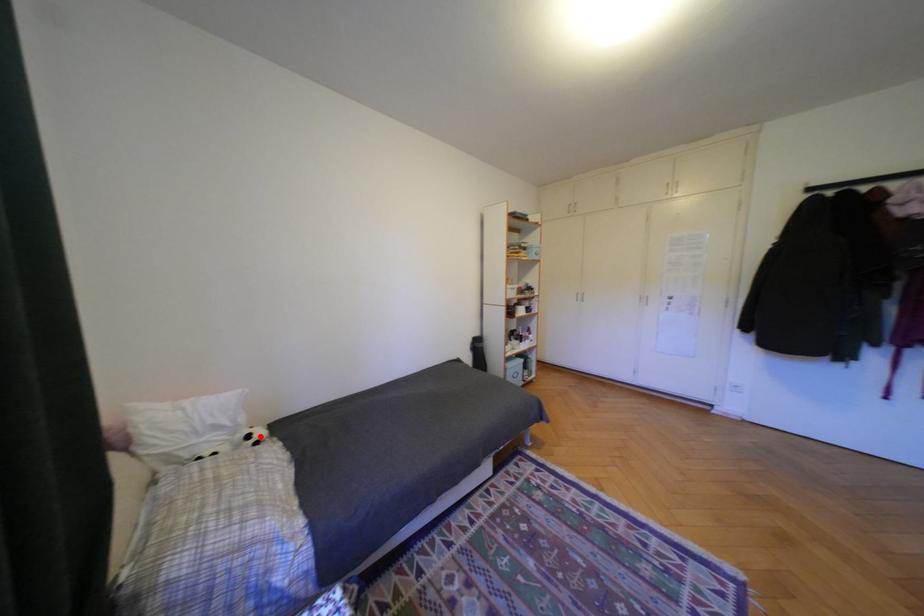
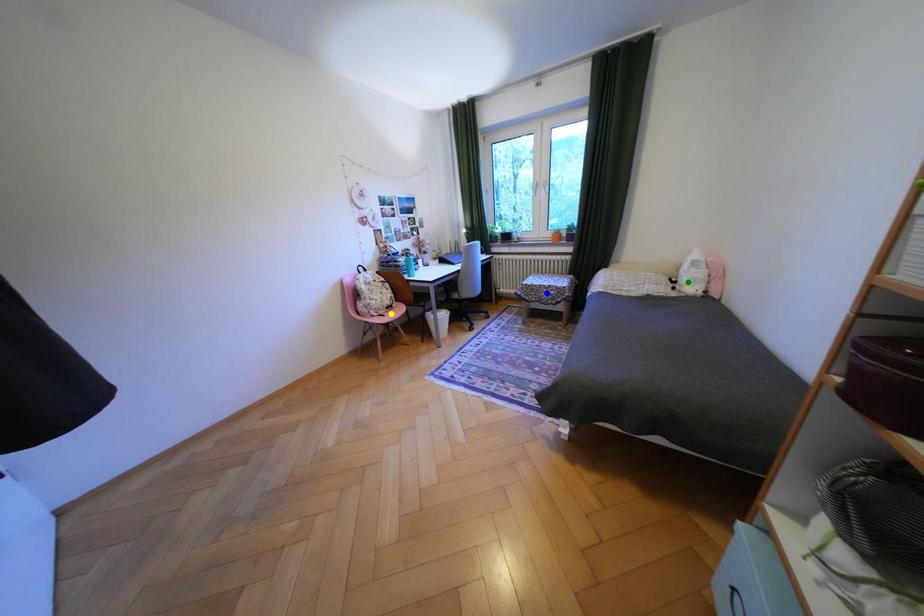
Question: I am providing you with two images of the same scene from different viewpoints. A red point is marked on the first image. You are given multiple points on the second image. Which point in image 2 represents the same 3d spot as the red point in image 1?

Choices:
 (A) yellow point
 (B) green point
 (C) blue point

Answer: (B)